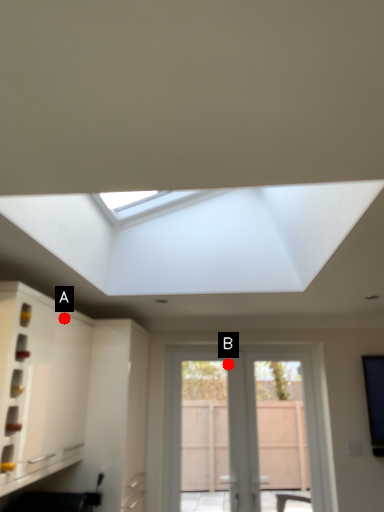
Question: Two points are circled on the image, labeled by A and B beside each circle. Which point is closer to the camera?

Choices:
 (A) A is closer
 (B) B is closer

Answer: (A)